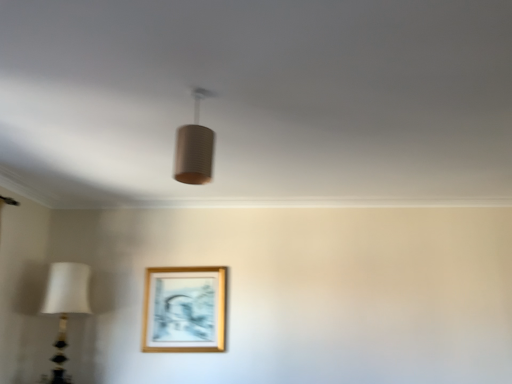
Question: Does point (66, 304) appear closer or farther from the camera than point (158, 296)?

Choices:
 (A) farther
 (B) closer

Answer: (B)

Question: Is white fabric lampshade at left, positioned as the first lamp in bottom-to-top order, spatially inside gold wooden picture frame at lower center, or outside of it?

Choices:
 (A) outside
 (B) inside

Answer: (A)

Question: Which of these objects is positioned farthest from the white fabric lampshade at left, arranged as the 2th lamp when viewed from the front?

Choices:
 (A) gold wooden picture frame at lower center
 (B) matte brown cylinder at center, which appears as the second lamp when viewed from the back

Answer: (B)

Question: Considering the real-world distances, which object is farthest from the gold wooden picture frame at lower center?

Choices:
 (A) white fabric lampshade at left, the first lamp from the back
 (B) matte brown cylinder at center, positioned as the first lamp in top-to-bottom order

Answer: (B)